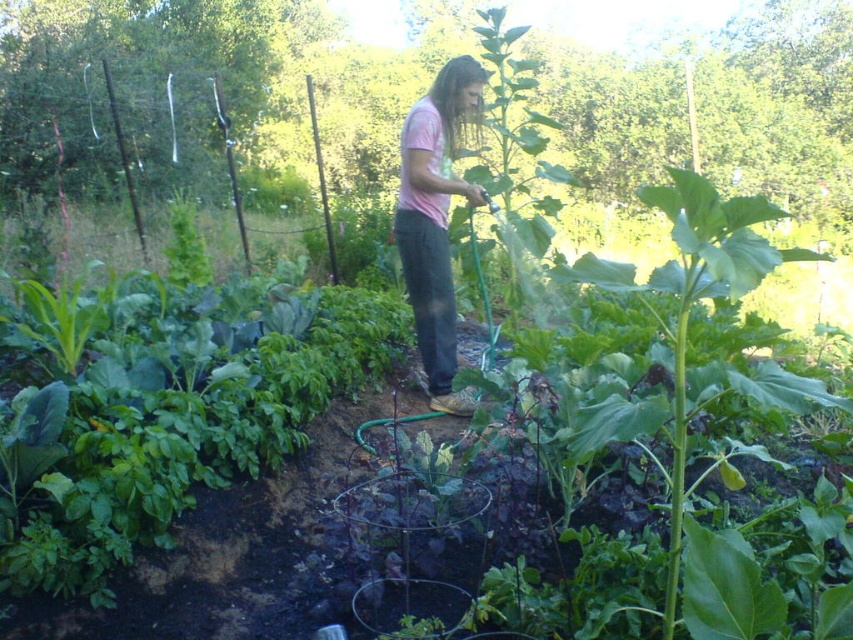
You are standing at the origin point in the garden. You want to water the plants located at point [178,426]. Which direction should you move to reach the green leafy vegetables at center?

The point [178,426] indicates the location of the green leafy vegetables at center, so you should move towards that coordinate to reach them.

You are a photographer trying to capture the garden scene. You want to ensure that both the green leafy vegetables at center and the pink matte shirt at center are clearly visible in your photo. Given their sizes, which object should you focus on to ensure both are in focus?

The green leafy vegetables at center is bigger than the pink matte shirt at center. To ensure both are in focus, you should focus on the larger object, which is the green leafy vegetables at center, as it will require a wider depth of field to capture details of both objects effectively.

You are standing at the entrance of the garden and want to water the green leafy vegetables at center. Which direction should you move to reach them?

The green leafy vegetables at center are located at point coordinates approximately 0.667 on the x axis and 0.211 on the y axis. Since you are at the entrance, you should move towards the center of the garden to reach them.